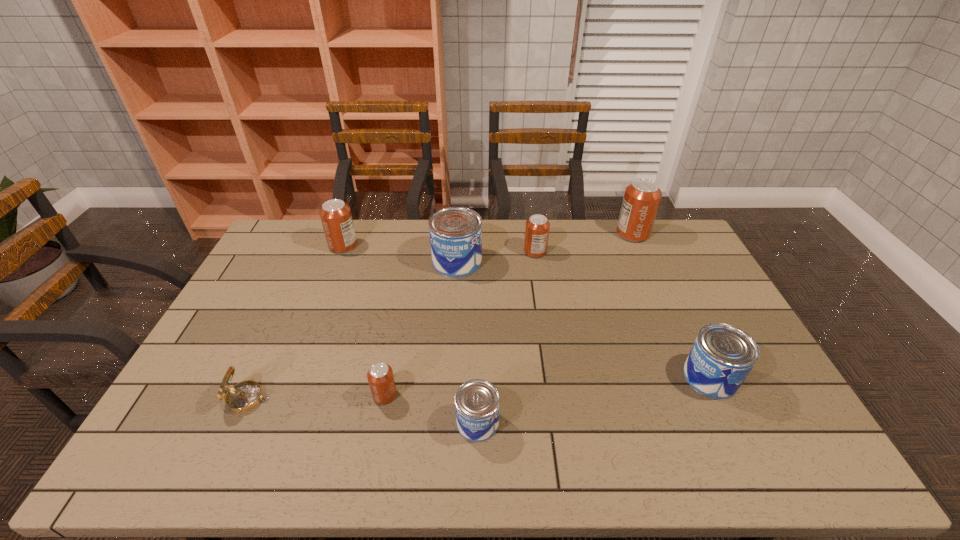
Find the location of a particular element. vacant space situated with the dial facing the compass is located at coordinates (303, 399).

Where is `vacant area situated on the back of the nearest orange can`? Image resolution: width=960 pixels, height=540 pixels. vacant area situated on the back of the nearest orange can is located at coordinates (390, 370).

This screenshot has width=960, height=540. Find the location of `free point located on the front label of the smallest blue can`. free point located on the front label of the smallest blue can is located at coordinates (575, 422).

Locate an element on the screen. object that is at the near edge is located at coordinates (477, 402).

I want to click on object located in the left edge section of the desktop, so click(243, 397).

Where is `object that is at the far right corner`? object that is at the far right corner is located at coordinates (642, 197).

At what (x,y) coordinates should I click in order to perform the action: click on vacant space at the far edge. Please return your answer as a coordinate pair (x, y). Looking at the image, I should click on (419, 239).

Identify the location of vacant area at the left edge of the desktop. This screenshot has height=540, width=960. (262, 334).

Where is `vacant area at the right edge`? The height and width of the screenshot is (540, 960). vacant area at the right edge is located at coordinates (669, 288).

This screenshot has height=540, width=960. In order to click on vacant region at the far left corner of the desktop in this screenshot , I will do `click(310, 231)`.